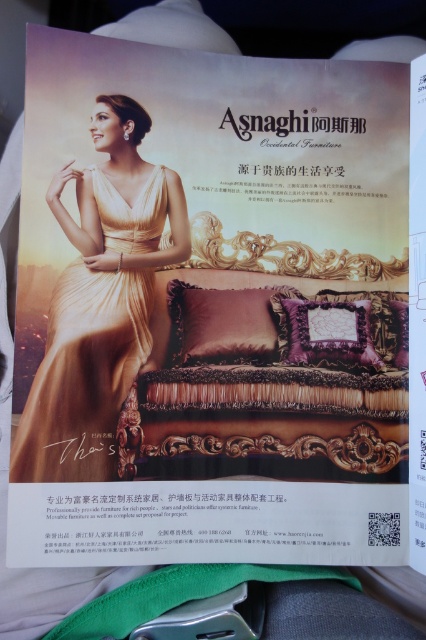
You are a photographer setting up for a photoshoot in this Asnaghi advertisement. You need to position a light source to highlight both the gold satin dress at left and the satin purple pillow at center. Based on their positions, where should you place the light source to ensure both objects are illuminated adequately?

The gold satin dress at left is located below the satin purple pillow at center. To illuminate both adequately, position the light source above the satin purple pillow at center so that it shines down onto both the pillow and the dress below.

You are a fashion designer who wants to create a dress similar to the gold satin dress at left. If your mannequin is 18 inches tall, will the dress fit the mannequin?

The gold satin dress at left is 20.09 inches away from viewer, so the distance does not indicate the dress size. The dress might still fit the 18 inch tall mannequin depending on its actual size, but the distance provided does not give enough information to determine this.